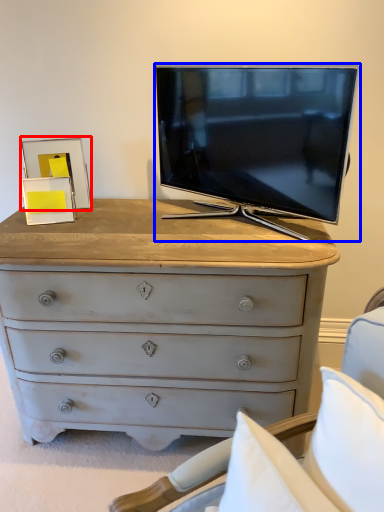
Question: Which object appears closest to the camera in this image, picture frame (highlighted by a red box) or television (highlighted by a blue box)?

Choices:
 (A) picture frame
 (B) television

Answer: (B)